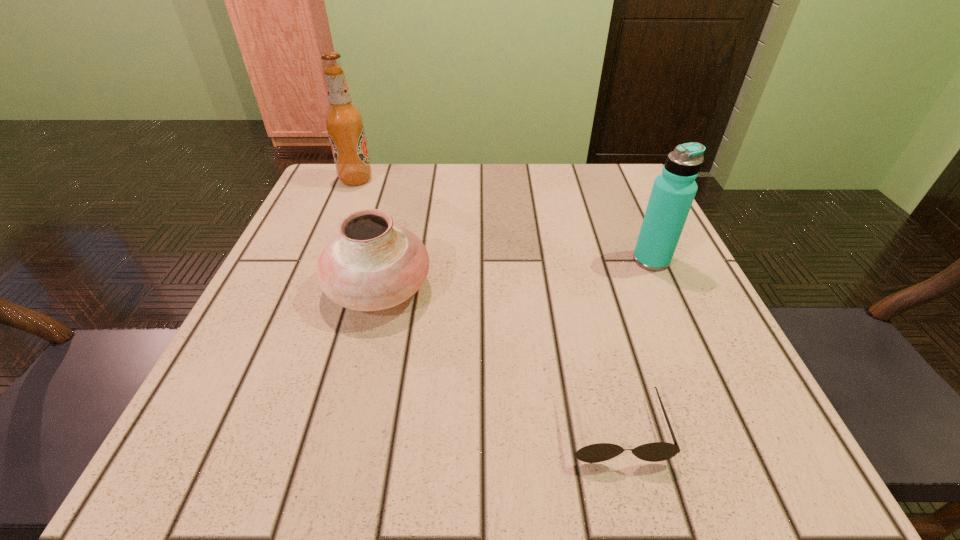
Locate an element on the screen. the tallest object is located at coordinates (344, 122).

The height and width of the screenshot is (540, 960). Find the location of `beer bottle`. beer bottle is located at coordinates (344, 122).

At what (x,y) coordinates should I click in order to perform the action: click on the rightmost object. Please return your answer as a coordinate pair (x, y). This screenshot has width=960, height=540. Looking at the image, I should click on (673, 192).

At what (x,y) coordinates should I click in order to perform the action: click on the third shortest object. Please return your answer as a coordinate pair (x, y). Looking at the image, I should click on (673, 192).

Image resolution: width=960 pixels, height=540 pixels. I want to click on the second shortest object, so click(x=373, y=264).

You are a GUI agent. You are given a task and a screenshot of the screen. Output one action in this format:
    pyautogui.click(x=<x>, y=<y>)
    Task: Click on the shortest object
    Image resolution: width=960 pixels, height=540 pixels.
    Given the screenshot: What is the action you would take?
    pyautogui.click(x=657, y=451)

This screenshot has width=960, height=540. I want to click on the nearest object, so click(x=657, y=451).

Find the location of a particular element. The height and width of the screenshot is (540, 960). blank area located 0.150m on the front label of the tallest object is located at coordinates (436, 180).

This screenshot has height=540, width=960. In order to click on free spot located 0.340m on the back of the third shortest object in this screenshot , I will do tap(609, 165).

Where is `free space located 0.200m on the right of the pottery`? This screenshot has height=540, width=960. free space located 0.200m on the right of the pottery is located at coordinates (545, 289).